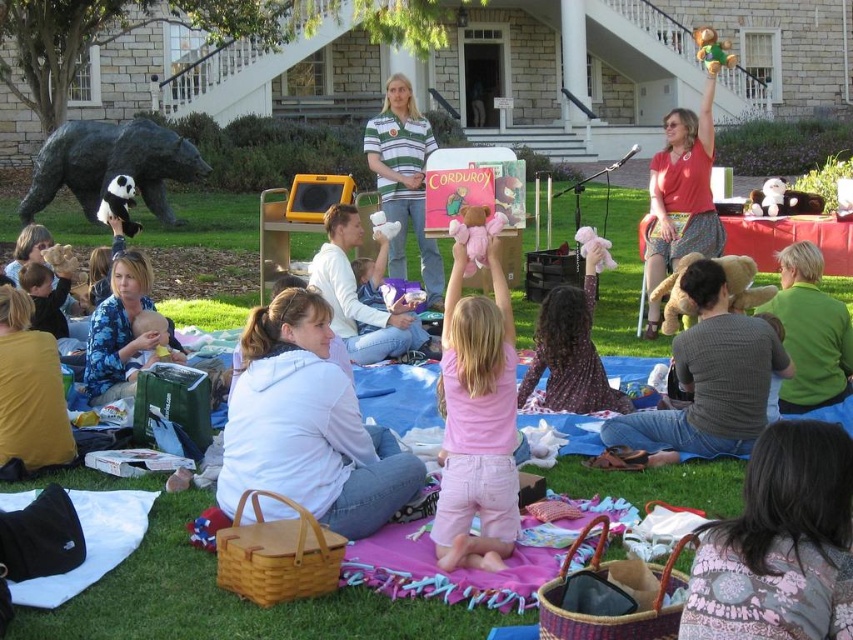
Consider the image. How much distance is there between matte red blouse at upper right and pink fabric dress at center?

matte red blouse at upper right is 13.39 feet away from pink fabric dress at center.

Who is more forward, (679,212) or (549,348)?

Point (549,348)

Which is behind, point (648, 182) or point (585, 387)?

Point (648, 182)

This screenshot has width=853, height=640. I want to click on matte red blouse at upper right, so click(x=682, y=196).

Is striped polo shirt at center above pink fabric dress at center?

Yes, striped polo shirt at center is above pink fabric dress at center.

Measure the distance between point (401, 164) and camera.

Point (401, 164) is 74.64 feet away from camera.

This screenshot has height=640, width=853. Find the location of `striped polo shirt at center`. striped polo shirt at center is located at coordinates (403, 179).

Between point (325, 371) and point (801, 340), which one is positioned behind?

The point (801, 340) is behind.

Looking at this image, which is above, white fleece hoodie at center or green fuzzy sweater at lower right?

green fuzzy sweater at lower right

Identify the location of white fleece hoodie at center. The width and height of the screenshot is (853, 640). (308, 426).

Locate an element on the screen. Image resolution: width=853 pixels, height=640 pixels. white fleece hoodie at center is located at coordinates (308, 426).